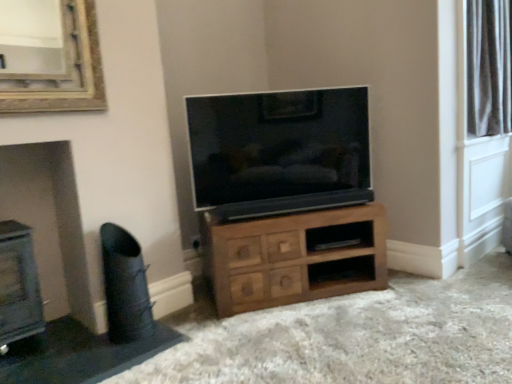
Question: Is black leather swivel chair at lower left behind wooden shelf at center?

Choices:
 (A) no
 (B) yes

Answer: (A)

Question: Can you confirm if black leather swivel chair at lower left is taller than wooden shelf at center?

Choices:
 (A) no
 (B) yes

Answer: (B)

Question: From a real-world perspective, is black leather swivel chair at lower left beneath wooden shelf at center?

Choices:
 (A) no
 (B) yes

Answer: (A)

Question: Is black leather swivel chair at lower left outside wooden shelf at center?

Choices:
 (A) yes
 (B) no

Answer: (A)

Question: Is black leather swivel chair at lower left with wooden shelf at center?

Choices:
 (A) no
 (B) yes

Answer: (A)

Question: Considering the positions of wooden chest of drawers at center and silky white curtains at upper right in the image, is wooden chest of drawers at center wider or thinner than silky white curtains at upper right?

Choices:
 (A) wide
 (B) thin

Answer: (A)

Question: Is wooden chest of drawers at center taller or shorter than silky white curtains at upper right?

Choices:
 (A) short
 (B) tall

Answer: (A)

Question: Is wooden chest of drawers at center in front of or behind silky white curtains at upper right in the image?

Choices:
 (A) front
 (B) behind

Answer: (A)

Question: From a real-world perspective, relative to silky white curtains at upper right, is wooden chest of drawers at center vertically above or below?

Choices:
 (A) below
 (B) above

Answer: (A)

Question: From the image's perspective, is matte black tv at center above or below black leather swivel chair at lower left?

Choices:
 (A) below
 (B) above

Answer: (B)

Question: Considering their positions, is matte black tv at center located in front of or behind black leather swivel chair at lower left?

Choices:
 (A) behind
 (B) front

Answer: (A)

Question: From their relative heights in the image, would you say matte black tv at center is taller or shorter than black leather swivel chair at lower left?

Choices:
 (A) tall
 (B) short

Answer: (A)

Question: Is point click(312, 130) closer or farther from the camera than point click(116, 230)?

Choices:
 (A) closer
 (B) farther

Answer: (B)

Question: In the image, is wooden chest of drawers at center positioned in front of or behind matte black tv at center?

Choices:
 (A) behind
 (B) front

Answer: (B)

Question: Is wooden chest of drawers at center bigger or smaller than matte black tv at center?

Choices:
 (A) small
 (B) big

Answer: (B)